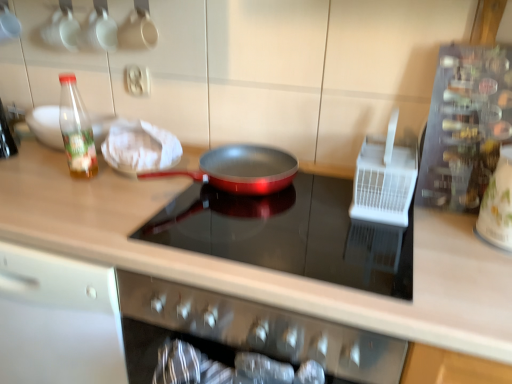
Identify the location of free space in front of white plastic utensil holder at right, which is the 1th appliance from left to right. The image size is (512, 384). (442, 239).